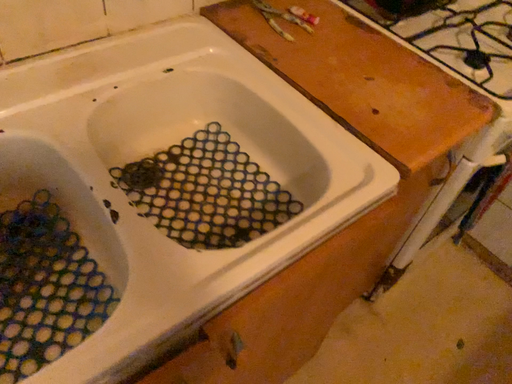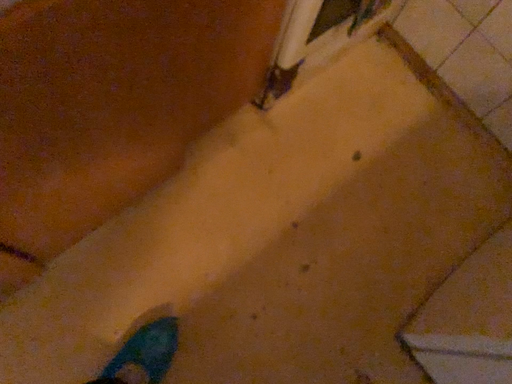
Question: Which way did the camera rotate in the video?

Choices:
 (A) rotated downward
 (B) rotated upward

Answer: (A)